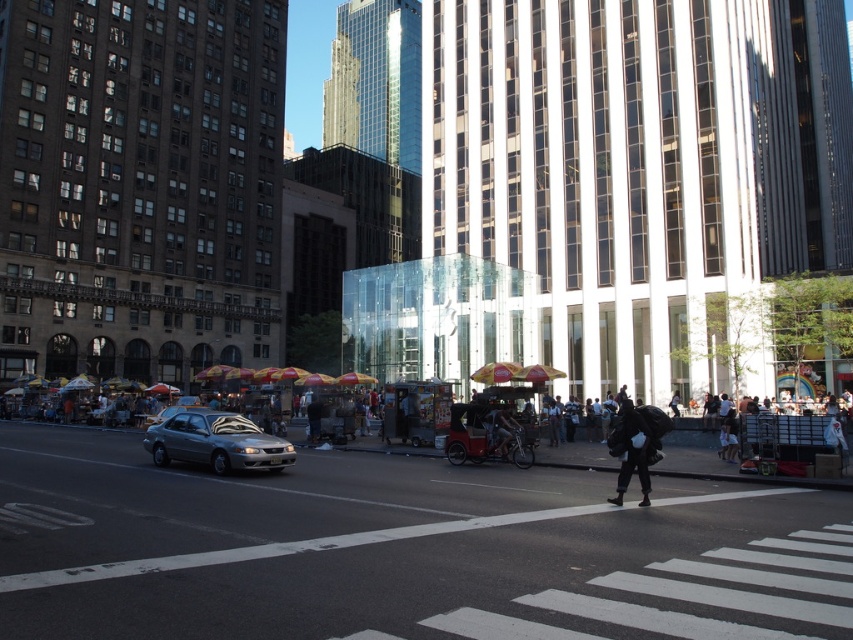
Question: Among these points, which one is farthest from the camera?

Choices:
 (A) (231, 419)
 (B) (729, 445)

Answer: (B)

Question: Is satin silver sedan at center to the right of black matte backpack at lower right from the viewer's perspective?

Choices:
 (A) no
 (B) yes

Answer: (A)

Question: Is black matte backpack at lower right smaller than white cotton shirt at center?

Choices:
 (A) no
 (B) yes

Answer: (A)

Question: Which of these objects is positioned closest to the black matte backpack at lower right?

Choices:
 (A) satin silver sedan at center
 (B) white cotton shirt at center

Answer: (B)

Question: Does satin silver sedan at center have a lesser width compared to white cotton shirt at center?

Choices:
 (A) yes
 (B) no

Answer: (B)

Question: Which point is farther to the camera?

Choices:
 (A) satin silver sedan at center
 (B) black matte backpack at lower right

Answer: (A)